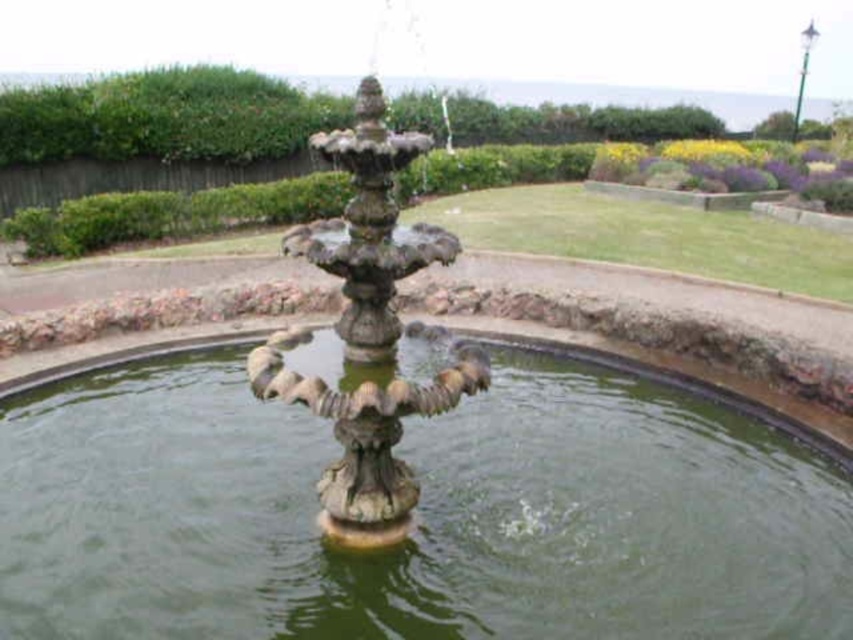
Between green stone water at center and stone fountain at center, which one is positioned lower?

green stone water at center is lower down.

Which is above, green stone water at center or stone fountain at center?

stone fountain at center is above.

Describe the element at coordinates (418, 515) in the screenshot. This screenshot has width=853, height=640. I see `green stone water at center` at that location.

The image size is (853, 640). I want to click on green stone water at center, so click(418, 515).